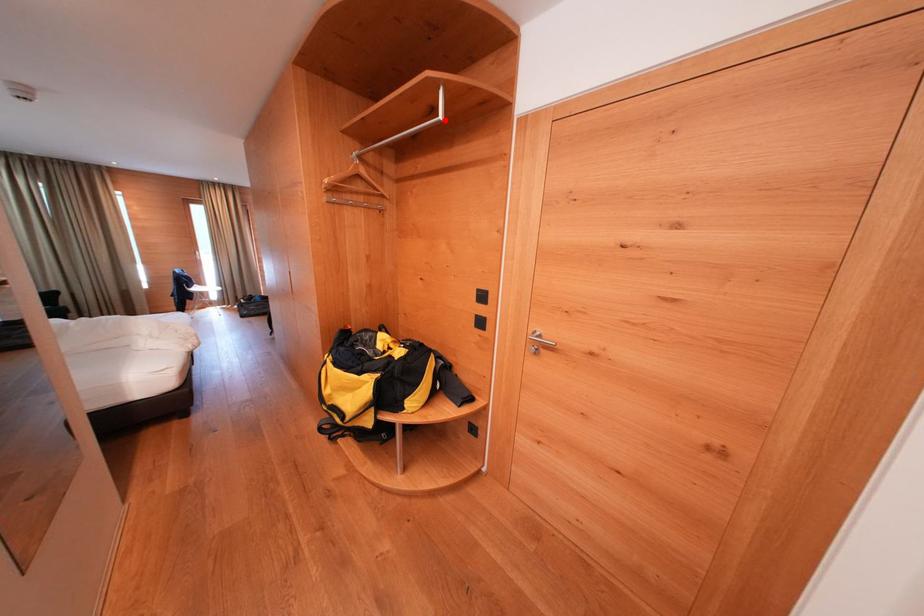
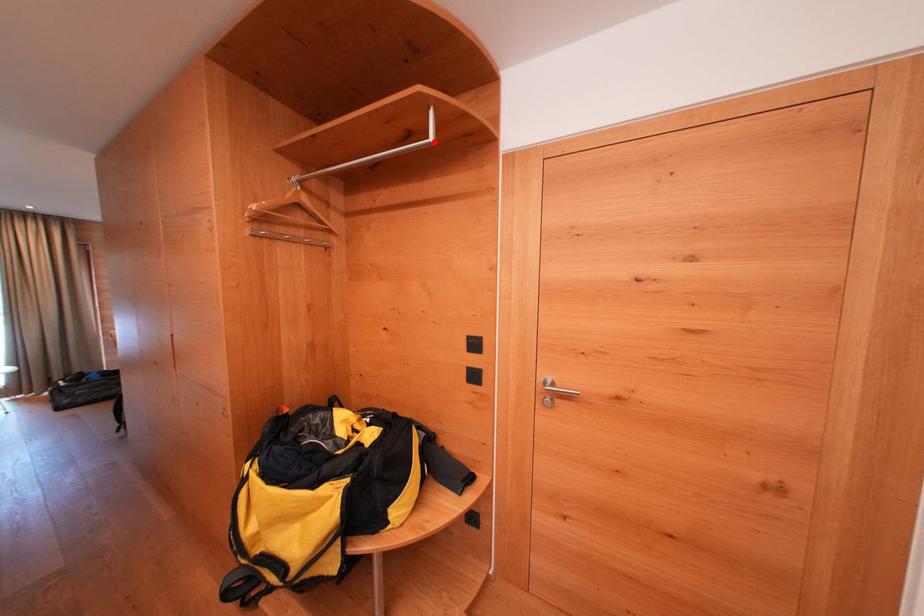
I am providing you with two images of the same scene from different viewpoints. A red point is marked on the first image and another point is marked on the second image. Do the highlighted points in image1 and image2 indicate the same real-world spot?

Yes